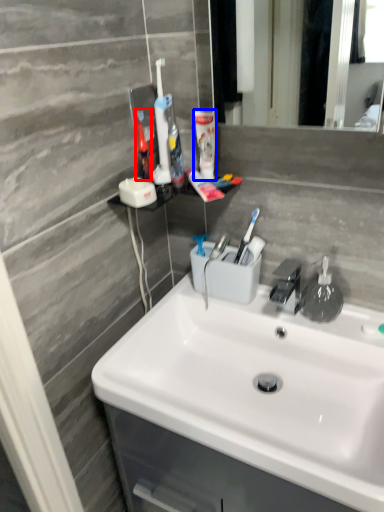
Question: Which object appears farthest to the camera in this image, toothbrush (highlighted by a red box) or mouthwash (highlighted by a blue box)?

Choices:
 (A) toothbrush
 (B) mouthwash

Answer: (B)